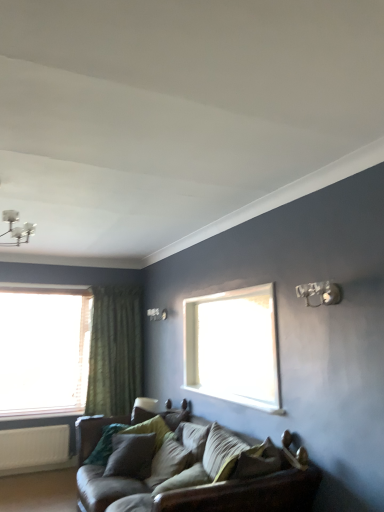
Describe the element at coordinates (184, 479) in the screenshot. This screenshot has width=384, height=512. I see `velvet green pillow at center, the first pillow from the front` at that location.

Locate an element on the screen. This screenshot has width=384, height=512. metallic silver light fixture at upper right is located at coordinates (320, 293).

Measure the distance between point (x=306, y=293) and camera.

Point (x=306, y=293) is 2.54 meters from camera.

The height and width of the screenshot is (512, 384). I want to click on velvet green pillow at center, which is the first pillow in back-to-front order, so coord(150,429).

Where is `white matte radiator at lower left`? This screenshot has width=384, height=512. white matte radiator at lower left is located at coordinates (34, 449).

Where is `velvet green pillow at center, the first pillow from the front`? This screenshot has width=384, height=512. velvet green pillow at center, the first pillow from the front is located at coordinates (184, 479).

Is metallic silver light fixture at upper right smaller than white matte radiator at lower left?

Yes.

Is metallic silver light fixture at upper right taller or shorter than white matte radiator at lower left?

metallic silver light fixture at upper right is shorter than white matte radiator at lower left.

From a real-world perspective, which object rests below the other?

white matte radiator at lower left.

How different are the orientations of metallic silver light fixture at upper right and white matte radiator at lower left in degrees?

There is a 88.8-degree angle between the facing directions of metallic silver light fixture at upper right and white matte radiator at lower left.

Can you tell me how much velvet green pillow at center, which appears as the second pillow when viewed from the back, and leather couch at lower center differ in facing direction?

0.892 degrees separate the facing orientations of velvet green pillow at center, which appears as the second pillow when viewed from the back, and leather couch at lower center.

Considering their positions, is velvet green pillow at center, which appears as the second pillow when viewed from the back, located in front of or behind leather couch at lower center?

Visually, velvet green pillow at center, which appears as the second pillow when viewed from the back, is located behind leather couch at lower center.

Is velvet green pillow at center, which appears as the second pillow when viewed from the back, thinner than leather couch at lower center?

Indeed, velvet green pillow at center, which appears as the second pillow when viewed from the back, has a lesser width compared to leather couch at lower center.

From a real-world perspective, which object rests below the other?

leather couch at lower center, from a real-world perspective.

Would you say velvet green pillow at center, the first pillow from the front, is to the left or to the right of green textured curtain at left in the picture?

In the image, velvet green pillow at center, the first pillow from the front, appears on the right side of green textured curtain at left.

Is velvet green pillow at center, the first pillow from the front, outside of green textured curtain at left?

velvet green pillow at center, the first pillow from the front, lies outside green textured curtain at left's area.

Which is behind, point (199, 472) or point (97, 351)?

Point (97, 351)

Between metallic silver light fixture at upper right and velvet green pillow at center, marked as the 3th pillow in a back-to-front arrangement, which one is positioned in front?

metallic silver light fixture at upper right is more forward.

Between point (308, 286) and point (208, 478), which one is positioned behind?

Point (208, 478)

From a real-world perspective, who is located lower, metallic silver light fixture at upper right or velvet green pillow at center, the first pillow from the front?

velvet green pillow at center, the first pillow from the front, is physically lower.

Is the surface of metallic silver light fixture at upper right in direct contact with velvet green pillow at center, marked as the 3th pillow in a back-to-front arrangement?

There is a gap between metallic silver light fixture at upper right and velvet green pillow at center, marked as the 3th pillow in a back-to-front arrangement.

Measure the distance from velvet green pillow at center, which is counted as the third pillow, starting from the front, to velvet green pillow at center, which appears as the second pillow when viewed from the front.

The distance of velvet green pillow at center, which is counted as the third pillow, starting from the front, from velvet green pillow at center, which appears as the second pillow when viewed from the front, is 8.70 inches.

Consider the image. Is velvet green pillow at center, which is counted as the third pillow, starting from the front, in front of velvet green pillow at center, which appears as the second pillow when viewed from the front?

No, velvet green pillow at center, which is counted as the third pillow, starting from the front, is further to the viewer.

Considering the sizes of objects velvet green pillow at center, which is counted as the third pillow, starting from the front, and velvet green pillow at center, which appears as the second pillow when viewed from the front, in the image provided, who is shorter, velvet green pillow at center, which is counted as the third pillow, starting from the front, or velvet green pillow at center, which appears as the second pillow when viewed from the front,?

velvet green pillow at center, which is counted as the third pillow, starting from the front.

Can you confirm if velvet green pillow at center, which is the first pillow in back-to-front order, is positioned to the left of velvet green pillow at center, which appears as the second pillow when viewed from the back?

Yes.

Does leather couch at lower center have a lesser width compared to metallic silver light fixture at upper right?

No, leather couch at lower center is not thinner than metallic silver light fixture at upper right.

Are leather couch at lower center and metallic silver light fixture at upper right located far from each other?

Yes, leather couch at lower center and metallic silver light fixture at upper right are quite far apart.

Who is shorter, leather couch at lower center or metallic silver light fixture at upper right?

With less height is metallic silver light fixture at upper right.

Does leather couch at lower center have a smaller size compared to metallic silver light fixture at upper right?

Actually, leather couch at lower center might be larger than metallic silver light fixture at upper right.

Between velvet green pillow at center, marked as the 3th pillow in a back-to-front arrangement, and metallic silver light fixture at upper right, which one has less height?

With less height is velvet green pillow at center, marked as the 3th pillow in a back-to-front arrangement.

Is velvet green pillow at center, the first pillow from the front, at the right side of metallic silver light fixture at upper right?

Incorrect, velvet green pillow at center, the first pillow from the front, is not on the right side of metallic silver light fixture at upper right.

You are a GUI agent. You are given a task and a screenshot of the screen. Output one action in this format:
    pyautogui.click(x=<x>, y=<y>)
    Task: Click on the 1st pillow behind the metallic silver light fixture at upper right, starting your count from the anchor
    The height and width of the screenshot is (512, 384).
    Given the screenshot: What is the action you would take?
    pyautogui.click(x=184, y=479)

Measure the distance from velvet green pillow at center, marked as the 3th pillow in a back-to-front arrangement, to metallic silver light fixture at upper right.

The distance of velvet green pillow at center, marked as the 3th pillow in a back-to-front arrangement, from metallic silver light fixture at upper right is 4.21 feet.

Identify the location of light fixture located above the white matte radiator at lower left (from the image's perspective). Image resolution: width=384 pixels, height=512 pixels. (320, 293).

Identify the location of the 2nd pillow positioned above the leather couch at lower center (from a real-world perspective). tap(168, 461).

Looking at the image, which one is located further to metallic silver light fixture at upper right, green textured curtain at left or velvet green pillow at center, the first pillow from the front?

Among the two, green textured curtain at left is located further to metallic silver light fixture at upper right.

Based on their spatial positions, is velvet green pillow at center, which appears as the second pillow when viewed from the back, or metallic silver light fixture at upper right further from white matte radiator at lower left?

metallic silver light fixture at upper right.

When comparing their distances from green textured curtain at left, does velvet green pillow at center, which appears as the second pillow when viewed from the front, or metallic silver light fixture at upper right seem further?

metallic silver light fixture at upper right is positioned further to the anchor green textured curtain at left.

When comparing their distances from velvet green pillow at center, which is the first pillow in back-to-front order, does velvet green pillow at center, marked as the 3th pillow in a back-to-front arrangement, or green textured curtain at left seem further?

Based on the image, green textured curtain at left appears to be further to velvet green pillow at center, which is the first pillow in back-to-front order.

Looking at the image, which one is located closer to metallic silver light fixture at upper right, velvet green pillow at center, which appears as the second pillow when viewed from the back, or velvet green pillow at center, which is the first pillow in back-to-front order?

Among the two, velvet green pillow at center, which appears as the second pillow when viewed from the back, is located nearer to metallic silver light fixture at upper right.

Considering their positions, is velvet green pillow at center, which is the first pillow in back-to-front order, positioned closer to velvet green pillow at center, which appears as the second pillow when viewed from the front, than leather couch at lower center?

velvet green pillow at center, which is the first pillow in back-to-front order, is closer to velvet green pillow at center, which appears as the second pillow when viewed from the front.

Estimate the real-world distances between objects in this image. Which object is closer to velvet green pillow at center, which is counted as the third pillow, starting from the front, velvet green pillow at center, the first pillow from the front, or metallic silver light fixture at upper right?

Based on the image, velvet green pillow at center, the first pillow from the front, appears to be nearer to velvet green pillow at center, which is counted as the third pillow, starting from the front.

When comparing their distances from velvet green pillow at center, which is the first pillow in back-to-front order, does white matte radiator at lower left or velvet green pillow at center, the first pillow from the front, seem further?

white matte radiator at lower left is further to velvet green pillow at center, which is the first pillow in back-to-front order.

Locate an element on the screen. pillow between velvet green pillow at center, which appears as the second pillow when viewed from the back, and green textured curtain at left from front to back is located at coordinates (150, 429).

Find the location of a particular element. The height and width of the screenshot is (512, 384). light fixture between leather couch at lower center and white matte radiator at lower left from front to back is located at coordinates (320, 293).

Image resolution: width=384 pixels, height=512 pixels. I want to click on studio couch between metallic silver light fixture at upper right and velvet green pillow at center, which appears as the second pillow when viewed from the back, in the vertical direction, so pos(189,468).

This screenshot has width=384, height=512. I want to click on radiator located between metallic silver light fixture at upper right and green textured curtain at left in the depth direction, so click(x=34, y=449).